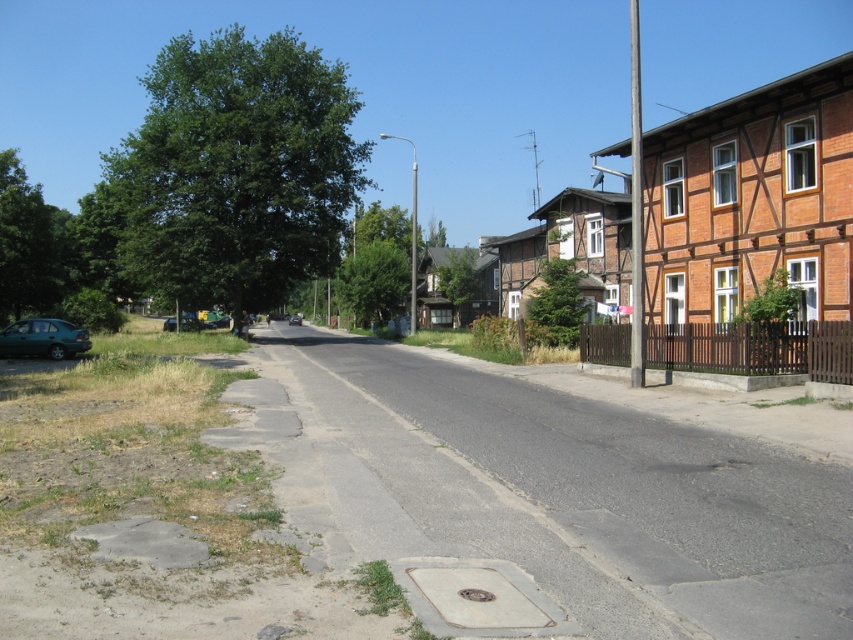
Describe the element at coordinates (636, 205) in the screenshot. I see `metallic pole at right` at that location.

Can you confirm if metallic pole at right is smaller than teal matte car at lower left?

Actually, metallic pole at right might be larger than teal matte car at lower left.

Where is `metallic pole at right`? metallic pole at right is located at coordinates click(x=636, y=205).

Between metallic pole at right and shiny black car at center, which one is positioned higher?

metallic pole at right is higher up.

Can you confirm if metallic pole at right is positioned to the left of shiny black car at center?

No, metallic pole at right is not to the left of shiny black car at center.

Who is more distant from viewer, (631, 141) or (299, 314)?

The point (299, 314) is more distant.

Identify the location of metallic pole at right. The height and width of the screenshot is (640, 853). (636, 205).

Can you confirm if metallic pole at right is positioned to the left of metallic pole at center?

In fact, metallic pole at right is to the right of metallic pole at center.

Image resolution: width=853 pixels, height=640 pixels. What do you see at coordinates (636, 205) in the screenshot?
I see `metallic pole at right` at bounding box center [636, 205].

The width and height of the screenshot is (853, 640). In order to click on metallic pole at right in this screenshot , I will do `click(636, 205)`.